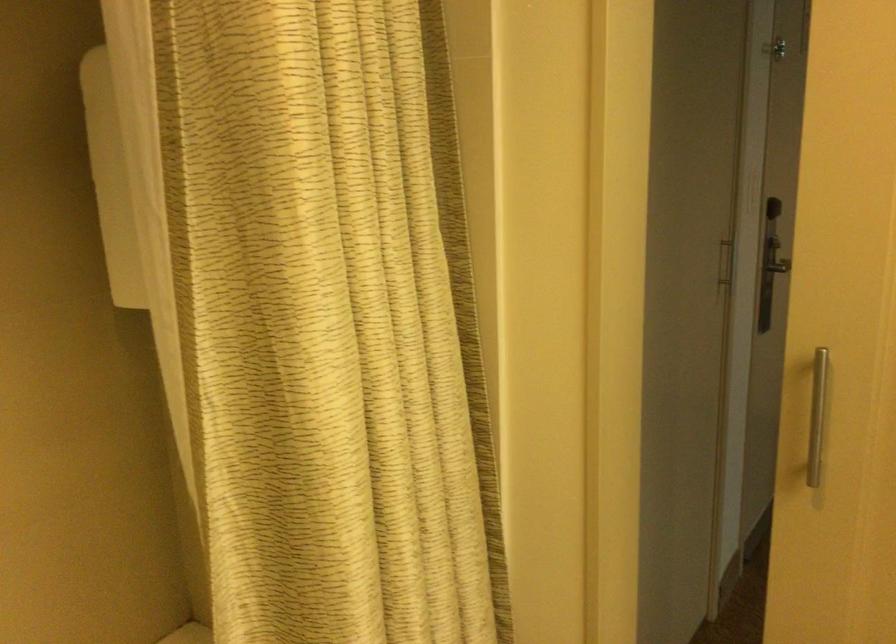
What do you see at coordinates (769, 292) in the screenshot? I see `the black door lever` at bounding box center [769, 292].